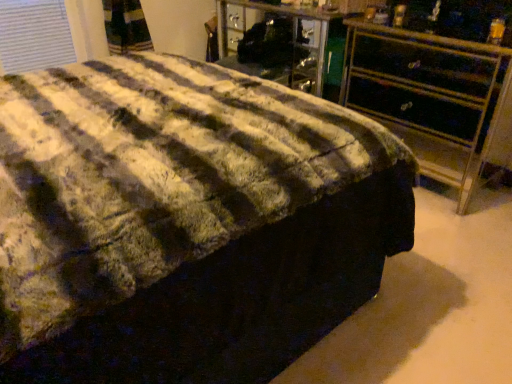
Question: Would you consider fluffy fabric bed at center to be distant from metallic gold chest of drawers at right?

Choices:
 (A) yes
 (B) no

Answer: (A)

Question: Does fluffy fabric bed at center have a lesser width compared to metallic gold chest of drawers at right?

Choices:
 (A) yes
 (B) no

Answer: (B)

Question: From a real-world perspective, is fluffy fabric bed at center physically above metallic gold chest of drawers at right?

Choices:
 (A) no
 (B) yes

Answer: (B)

Question: From the image's perspective, does fluffy fabric bed at center appear higher than metallic gold chest of drawers at right?

Choices:
 (A) yes
 (B) no

Answer: (B)

Question: From a real-world perspective, is fluffy fabric bed at center positioned under metallic gold chest of drawers at right based on gravity?

Choices:
 (A) no
 (B) yes

Answer: (A)

Question: Does fluffy fabric bed at center have a smaller size compared to metallic gold chest of drawers at right?

Choices:
 (A) yes
 (B) no

Answer: (B)

Question: Considering the relative sizes of metallic gold chest of drawers at right and fluffy fabric bed at center in the image provided, is metallic gold chest of drawers at right smaller than fluffy fabric bed at center?

Choices:
 (A) no
 (B) yes

Answer: (B)

Question: From a real-world perspective, is metallic gold chest of drawers at right on top of fluffy fabric bed at center?

Choices:
 (A) no
 (B) yes

Answer: (A)

Question: Is metallic gold chest of drawers at right wider than fluffy fabric bed at center?

Choices:
 (A) no
 (B) yes

Answer: (A)

Question: Is metallic gold chest of drawers at right bigger than fluffy fabric bed at center?

Choices:
 (A) yes
 (B) no

Answer: (B)

Question: Is metallic gold chest of drawers at right in front of fluffy fabric bed at center?

Choices:
 (A) no
 (B) yes

Answer: (A)

Question: Is metallic gold chest of drawers at right completely or partially outside of fluffy fabric bed at center?

Choices:
 (A) yes
 (B) no

Answer: (A)

Question: Would you say metallic gold chest of drawers at right is to the left or to the right of fluffy fabric bed at center in the picture?

Choices:
 (A) left
 (B) right

Answer: (B)